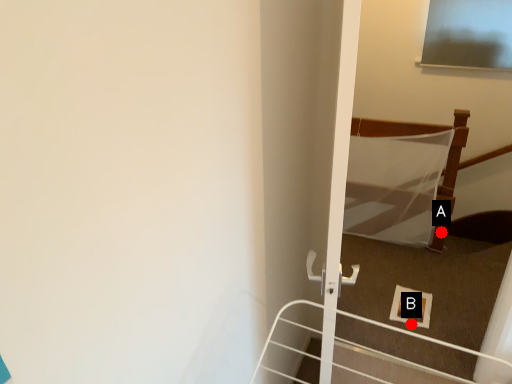
Question: Two points are circled on the image, labeled by A and B beside each circle. Which point is farther to the camera?

Choices:
 (A) A is further
 (B) B is further

Answer: (A)